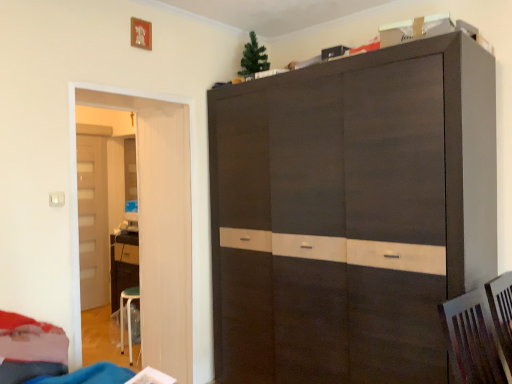
Question: Does velvet red bed at lower left have a lesser width compared to white glossy door at left, positioned as the second door in back-to-front order?

Choices:
 (A) no
 (B) yes

Answer: (A)

Question: Does velvet red bed at lower left have a larger size compared to white glossy door at left, which appears as the first door when viewed from the front?

Choices:
 (A) yes
 (B) no

Answer: (B)

Question: Is velvet red bed at lower left oriented away from white glossy door at left, which appears as the first door when viewed from the front?

Choices:
 (A) no
 (B) yes

Answer: (A)

Question: Is velvet red bed at lower left facing towards white glossy door at left, which appears as the first door when viewed from the front?

Choices:
 (A) yes
 (B) no

Answer: (B)

Question: Is velvet red bed at lower left at the left side of white glossy door at left, which appears as the first door when viewed from the front?

Choices:
 (A) yes
 (B) no

Answer: (A)

Question: In terms of width, does velvet red bed at lower left look wider or thinner when compared to white glossy door at left, which is the 2th door in left-to-right order?

Choices:
 (A) wide
 (B) thin

Answer: (A)

Question: In the image, is velvet red bed at lower left positioned in front of or behind white glossy door at left, which appears as the first door when viewed from the front?

Choices:
 (A) front
 (B) behind

Answer: (A)

Question: Is velvet red bed at lower left inside the boundaries of white glossy door at left, positioned as the second door in back-to-front order, or outside?

Choices:
 (A) outside
 (B) inside

Answer: (A)

Question: Is point (9, 352) closer or farther from the camera than point (145, 208)?

Choices:
 (A) farther
 (B) closer

Answer: (B)

Question: From a real-world perspective, relative to velvet red bed at lower left, is white glossy door at left, which is the 2th door in left-to-right order, vertically above or below?

Choices:
 (A) below
 (B) above

Answer: (B)

Question: Looking at the image, does white glossy door at left, positioned as the second door in back-to-front order, seem bigger or smaller compared to velvet red bed at lower left?

Choices:
 (A) big
 (B) small

Answer: (A)

Question: Considering the relative positions of white glossy door at left, which is the 2th door in left-to-right order, and velvet red bed at lower left in the image provided, is white glossy door at left, which is the 2th door in left-to-right order, to the left or to the right of velvet red bed at lower left?

Choices:
 (A) left
 (B) right

Answer: (B)

Question: Is white glossy door at left, positioned as the second door in back-to-front order, taller or shorter than velvet red bed at lower left?

Choices:
 (A) short
 (B) tall

Answer: (B)

Question: Is white glossy door at left, positioned as the second door in back-to-front order, inside or outside of light brown wood door at left, which ranks as the 1th door in back-to-front order?

Choices:
 (A) inside
 (B) outside

Answer: (B)

Question: From their relative heights in the image, would you say white glossy door at left, positioned as the second door in back-to-front order, is taller or shorter than light brown wood door at left, the 2th door in the front-to-back sequence?

Choices:
 (A) short
 (B) tall

Answer: (A)